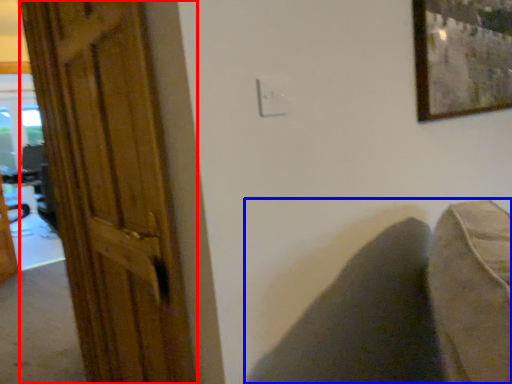
Question: Which point is closer to the camera, door (highlighted by a red box) or swivel chair (highlighted by a blue box)?

Choices:
 (A) door
 (B) swivel chair

Answer: (A)